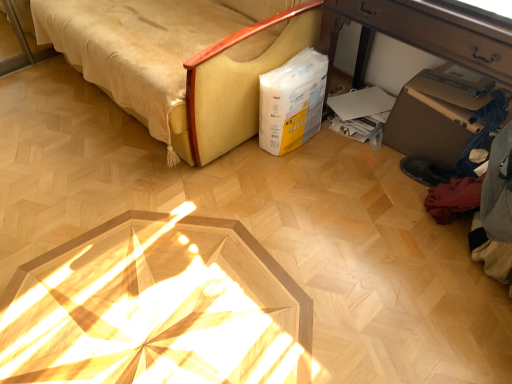
Question: Considering the relative positions of wooden desk at lower right and beige fabric sofa at upper left in the image provided, is wooden desk at lower right to the left of beige fabric sofa at upper left from the viewer's perspective?

Choices:
 (A) no
 (B) yes

Answer: (A)

Question: Does wooden desk at lower right have a greater height compared to beige fabric sofa at upper left?

Choices:
 (A) yes
 (B) no

Answer: (B)

Question: Considering the relative sizes of wooden desk at lower right and beige fabric sofa at upper left in the image provided, is wooden desk at lower right wider than beige fabric sofa at upper left?

Choices:
 (A) no
 (B) yes

Answer: (A)

Question: From a real-world perspective, is wooden desk at lower right on top of beige fabric sofa at upper left?

Choices:
 (A) no
 (B) yes

Answer: (A)

Question: Can we say wooden desk at lower right lies outside beige fabric sofa at upper left?

Choices:
 (A) no
 (B) yes

Answer: (B)

Question: Is beige fabric sofa at upper left a part of wooden desk at lower right?

Choices:
 (A) yes
 (B) no

Answer: (B)

Question: From the image's perspective, does wooden desk at lower right appear higher than brown cardboard box at lower right?

Choices:
 (A) no
 (B) yes

Answer: (B)

Question: Is wooden desk at lower right in front of brown cardboard box at lower right?

Choices:
 (A) yes
 (B) no

Answer: (A)

Question: Can you confirm if wooden desk at lower right is taller than brown cardboard box at lower right?

Choices:
 (A) no
 (B) yes

Answer: (B)

Question: From the image's perspective, is wooden desk at lower right located beneath brown cardboard box at lower right?

Choices:
 (A) no
 (B) yes

Answer: (A)

Question: Considering the relative sizes of wooden desk at lower right and brown cardboard box at lower right in the image provided, is wooden desk at lower right wider than brown cardboard box at lower right?

Choices:
 (A) no
 (B) yes

Answer: (B)

Question: Are wooden desk at lower right and brown cardboard box at lower right beside each other?

Choices:
 (A) no
 (B) yes

Answer: (A)

Question: From the image's perspective, is brown cardboard box at lower right under white paper bag at center-right?

Choices:
 (A) no
 (B) yes

Answer: (B)